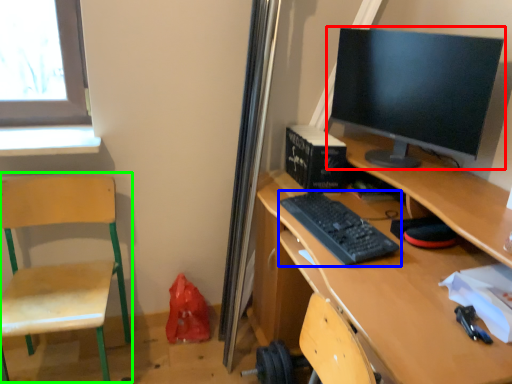
Question: Which is farther away from computer monitor (highlighted by a red box)? computer keyboard (highlighted by a blue box) or swivel chair (highlighted by a green box)?

Choices:
 (A) computer keyboard
 (B) swivel chair

Answer: (B)